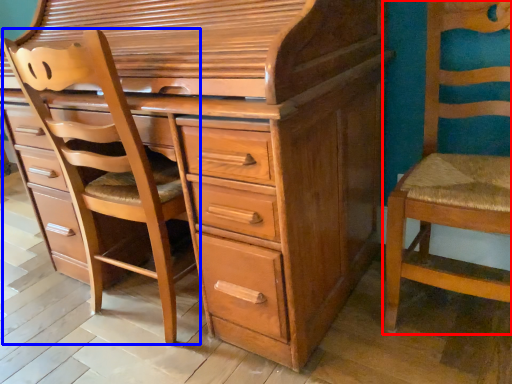
Question: Which object is closer to the camera taking this photo, chair (highlighted by a red box) or armchair (highlighted by a blue box)?

Choices:
 (A) chair
 (B) armchair

Answer: (A)